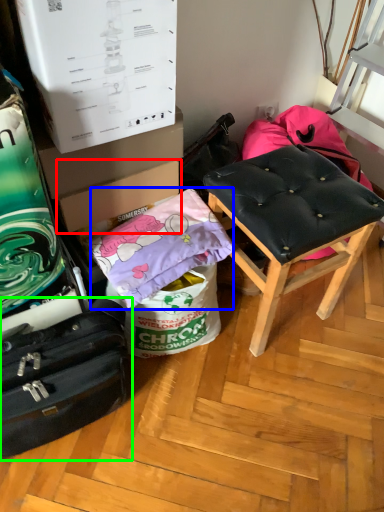
Question: Based on their relative distances, which object is farther from cardboard box (highlighted by a red box)? Choose from material (highlighted by a blue box) and suitcase (highlighted by a green box).

Choices:
 (A) material
 (B) suitcase

Answer: (B)